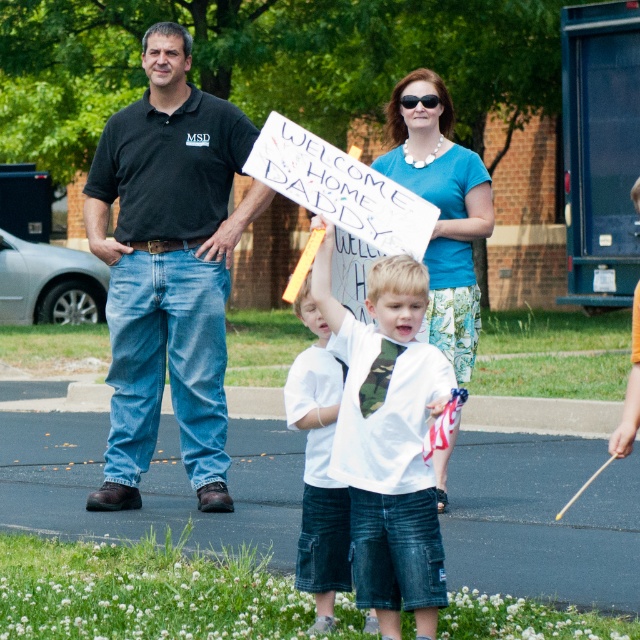
Consider the image. Is black cotton polo shirt at center positioned at the back of white cotton shirt at center?

Yes, black cotton polo shirt at center is behind white cotton shirt at center.

Locate an element on the screen. black cotton polo shirt at center is located at coordinates (168, 268).

Does black cotton polo shirt at center have a greater width compared to blue fabric shirt at upper center?

Correct, the width of black cotton polo shirt at center exceeds that of blue fabric shirt at upper center.

How much distance is there between black cotton polo shirt at center and blue fabric shirt at upper center?

black cotton polo shirt at center is 1.67 meters from blue fabric shirt at upper center.

The width and height of the screenshot is (640, 640). Identify the location of black cotton polo shirt at center. (168, 268).

Locate an element on the screen. This screenshot has width=640, height=640. black cotton polo shirt at center is located at coordinates pyautogui.click(x=168, y=268).

Does point (120, 454) lie behind point (394, 468)?

Yes, it is.

Which of these two, black cotton polo shirt at center or camouflage tie at center, stands shorter?

Standing shorter between the two is camouflage tie at center.

Is point (157, 408) closer to viewer compared to point (419, 288)?

No, (157, 408) is behind (419, 288).

At what (x,y) coordinates should I click in order to perform the action: click on black cotton polo shirt at center. Please return your answer as a coordinate pair (x, y). The height and width of the screenshot is (640, 640). Looking at the image, I should click on (168, 268).